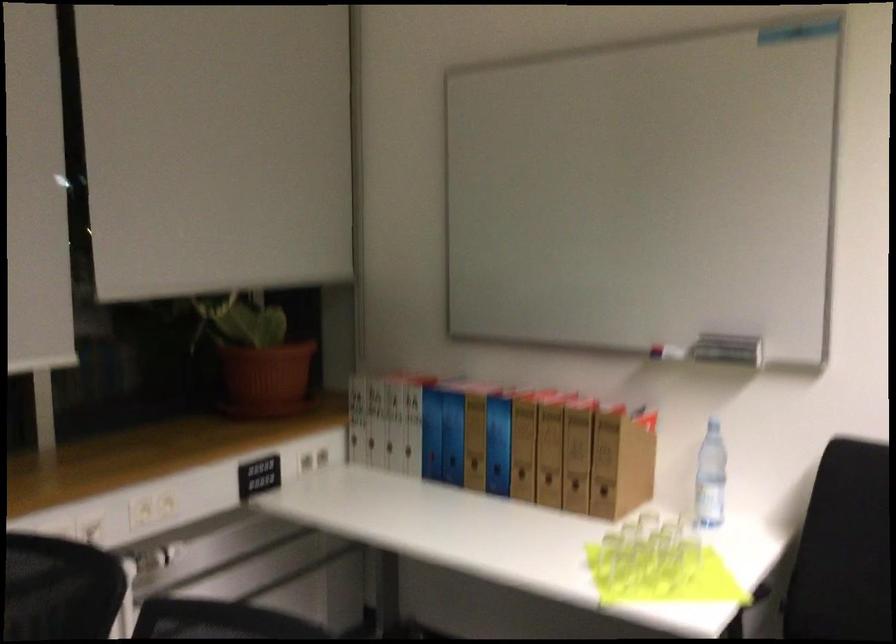
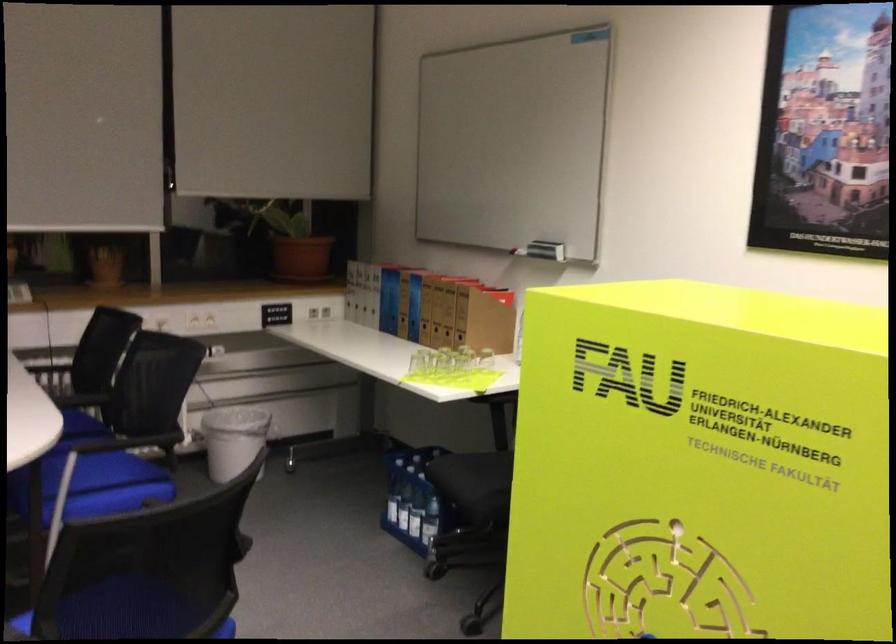
Locate, in the second image, the point that corresponds to point (463, 464) in the first image.

(398, 317)